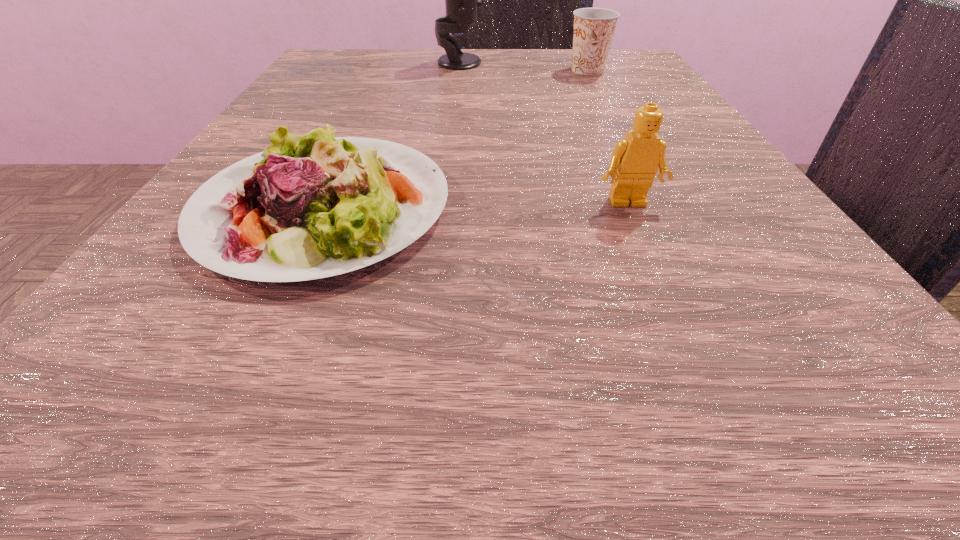
Where is `object that is at the left edge`? object that is at the left edge is located at coordinates (346, 202).

Locate an element on the screen. Image resolution: width=960 pixels, height=540 pixels. Lego located at the right edge is located at coordinates (635, 160).

Image resolution: width=960 pixels, height=540 pixels. Find the location of `Dixie cup that is at the right edge`. Dixie cup that is at the right edge is located at coordinates (x=594, y=28).

Where is `object positioned at the far right corner`? Image resolution: width=960 pixels, height=540 pixels. object positioned at the far right corner is located at coordinates pyautogui.click(x=594, y=28).

This screenshot has width=960, height=540. In the image, there is a desktop. What are the coordinates of `vacant space at the far edge` in the screenshot? It's located at (533, 54).

What are the coordinates of `vacant space at the near edge` in the screenshot? It's located at (497, 375).

I want to click on free region at the right edge of the desktop, so click(x=611, y=143).

Locate an element on the screen. Image resolution: width=960 pixels, height=540 pixels. blank area at the far left corner is located at coordinates (369, 92).

The image size is (960, 540). What are the coordinates of `blank space at the near left corner of the desktop` in the screenshot? It's located at (213, 379).

I want to click on vacant space at the far right corner of the desktop, so click(570, 84).